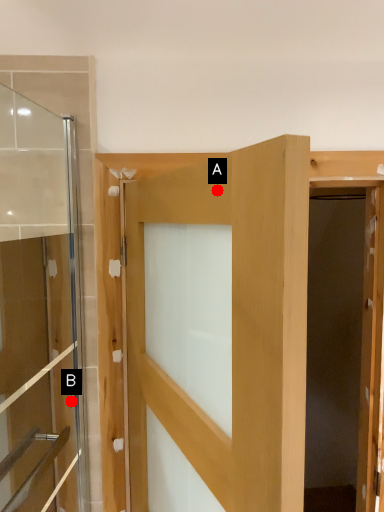
Question: Two points are circled on the image, labeled by A and B beside each circle. Which point appears farthest from the camera in this image?

Choices:
 (A) A is further
 (B) B is further

Answer: (B)